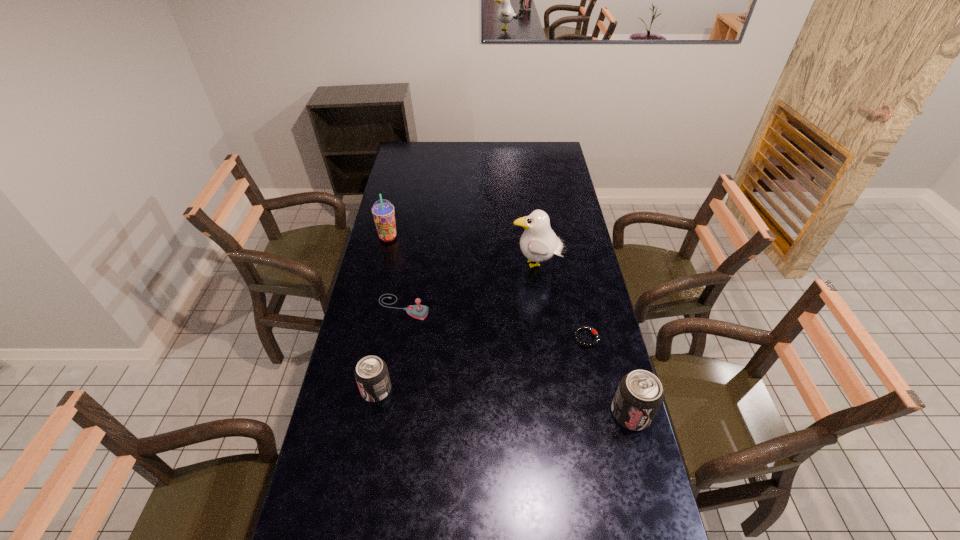
The height and width of the screenshot is (540, 960). What are the coordinates of `soda can that is at the left edge` in the screenshot? It's located at (371, 373).

I want to click on smoothie at the left edge, so pos(383,213).

Identify the location of joystick that is at the left edge. The width and height of the screenshot is (960, 540). (418, 311).

Find the location of `soda can situated at the right edge`. soda can situated at the right edge is located at coordinates (640, 394).

You are a GUI agent. You are given a task and a screenshot of the screen. Output one action in this format:
    pyautogui.click(x=<x>, y=<y>)
    Task: Click on the gull located at the right edge
    The height and width of the screenshot is (540, 960).
    Given the screenshot: What is the action you would take?
    pyautogui.click(x=538, y=243)

This screenshot has height=540, width=960. In order to click on bracelet that is at the right edge in this screenshot , I will do `click(578, 329)`.

The image size is (960, 540). In the image, there is a desktop. Find the location of `blank space at the far edge`. blank space at the far edge is located at coordinates (476, 153).

Where is `vacant space at the left edge of the desktop`? The height and width of the screenshot is (540, 960). vacant space at the left edge of the desktop is located at coordinates click(x=417, y=170).

In the image, there is a desktop. Identify the location of vacant space at the right edge. (571, 296).

Locate an element on the screen. The width and height of the screenshot is (960, 540). vacant space that is in between the gull and the bracelet is located at coordinates (562, 301).